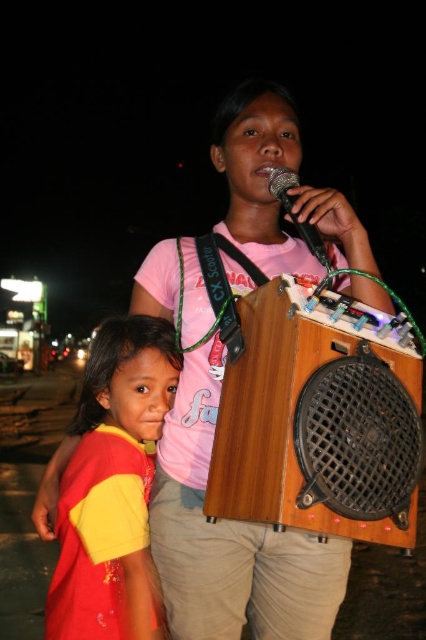
You are setting up a stage for a small performance. You have the wooden speaker at center and the yellow fabric shirt at lower left. Which object takes up more space when placed on the stage?

The yellow fabric shirt at lower left takes up more space than the wooden speaker at center because the wooden speaker at center occupies less space than yellow fabric shirt at lower left.

You are organizing a small outdoor concert and need to set up equipment. You have a wooden speaker at center and a black matte microphone at upper center. Which object should you place first if you want to ensure there is enough space for both?

The wooden speaker at center is larger in size than the black matte microphone at upper center, so you should place the wooden speaker at center first to ensure there is enough space for both.